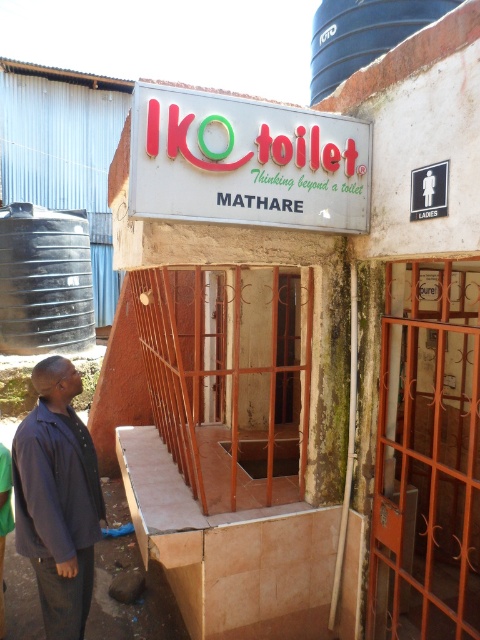
Based on the photo, is black plastic water tank at upper left to the right of blue plastic silo at upper center from the viewer's perspective?

In fact, black plastic water tank at upper left is to the left of blue plastic silo at upper center.

Is black plastic water tank at upper left positioned behind blue plastic silo at upper center?

Yes, it is.

Locate an element on the screen. black plastic water tank at upper left is located at coordinates (45, 280).

Who is shorter, dark blue shirt at lower left or blue plastic silo at upper center?

blue plastic silo at upper center

This screenshot has height=640, width=480. Describe the element at coordinates (58, 499) in the screenshot. I see `dark blue shirt at lower left` at that location.

At what (x,y) coordinates should I click in order to perform the action: click on dark blue shirt at lower left. Please return your answer as a coordinate pair (x, y). This screenshot has width=480, height=640. Looking at the image, I should click on tap(58, 499).

Between dark blue shirt at lower left and black plastic water tank at upper left, which one is positioned higher?

black plastic water tank at upper left is higher up.

Is point (20, 499) closer to camera compared to point (76, 314)?

That is True.

Identify the location of dark blue shirt at lower left. (58, 499).